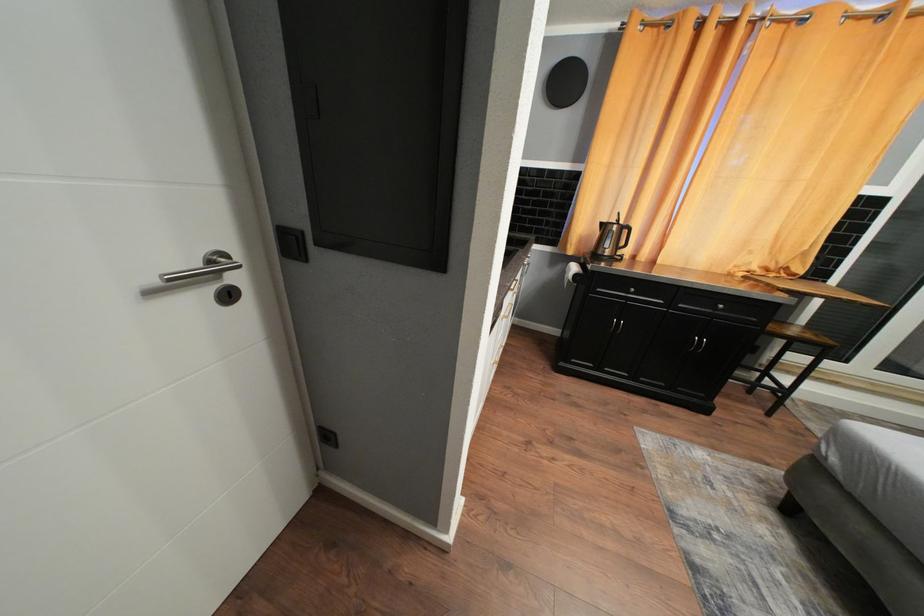
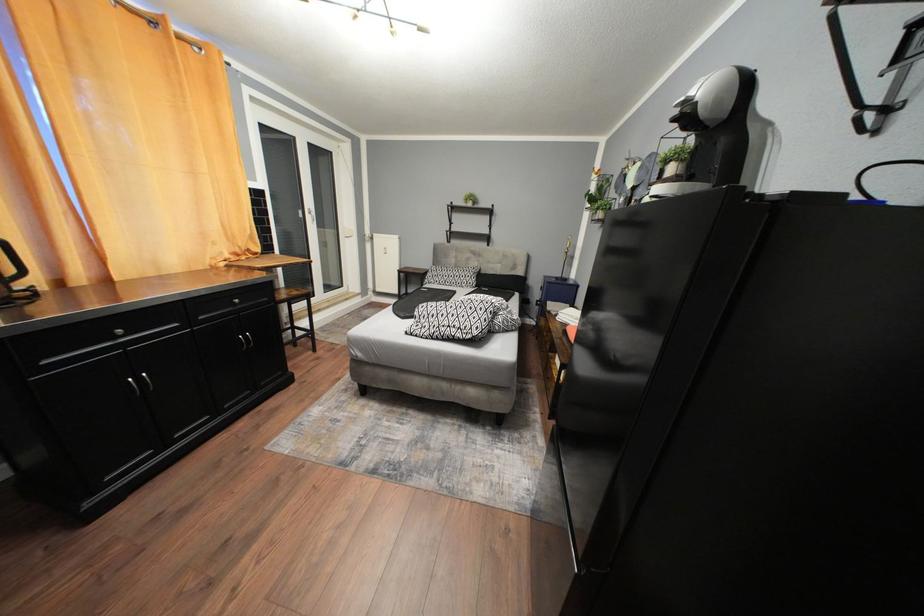
Based on the continuous images, in which direction is the camera rotating?

The rotation direction of the camera is right-down.